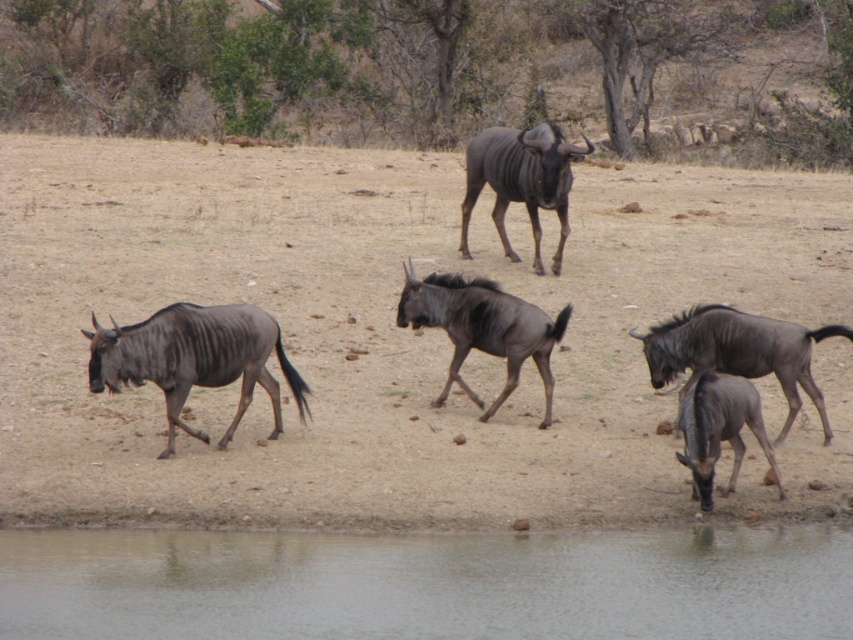
Question: Observing the image, what is the correct spatial positioning of transparent water at lower center in reference to dark brown fur at center?

Choices:
 (A) above
 (B) below

Answer: (B)

Question: Can you confirm if dark brown fur at right is wider than dark brown fur antelope at center?

Choices:
 (A) no
 (B) yes

Answer: (B)

Question: Among these objects, which one is farthest from the camera?

Choices:
 (A) dark brown fur at right
 (B) transparent water at lower center
 (C) brown sandy ground at center

Answer: (A)

Question: Estimate the real-world distances between objects in this image. Which object is closer to the dark brown fur at right?

Choices:
 (A) brown sandy ground at center
 (B) transparent water at lower center
 (C) gray matte antelope at lower right
 (D) brown matte/glossy wildebeest at left

Answer: (C)

Question: Does brown matte/glossy wildebeest at left have a larger size compared to gray matte antelope at lower right?

Choices:
 (A) no
 (B) yes

Answer: (B)

Question: Which point appears closest to the camera in this image?

Choices:
 (A) (705, 625)
 (B) (735, 385)
 (C) (102, 378)

Answer: (A)